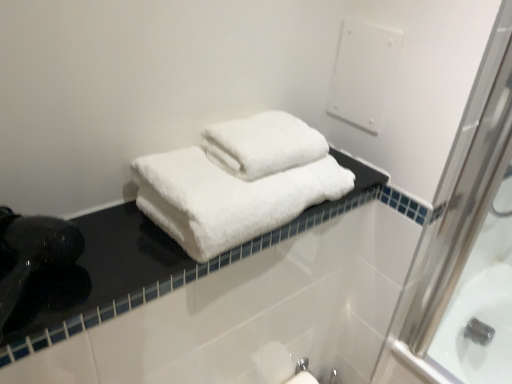
Locate an element on the screen. This screenshot has width=512, height=384. white fluffy towels at center is located at coordinates (227, 198).

The width and height of the screenshot is (512, 384). What do you see at coordinates (227, 198) in the screenshot?
I see `white fluffy towels at center` at bounding box center [227, 198].

This screenshot has height=384, width=512. Identify the location of black glossy counter top at center. (141, 267).

Describe the element at coordinates (141, 267) in the screenshot. I see `black glossy counter top at center` at that location.

Where is `white fluffy towels at center`? The image size is (512, 384). white fluffy towels at center is located at coordinates (227, 198).

Which is more to the left, black glossy counter top at center or white fluffy towels at center?

black glossy counter top at center is more to the left.

Is the position of black glossy counter top at center less distant than that of white fluffy towels at center?

Yes.

Which is behind, point (59, 305) or point (215, 203)?

The point (215, 203) is more distant.

From the image's perspective, which one is positioned higher, black glossy counter top at center or white fluffy towels at center?

white fluffy towels at center appears higher in the image.

From a real-world perspective, is black glossy counter top at center positioned above or below white fluffy towels at center?

black glossy counter top at center is below white fluffy towels at center.

Is black glossy counter top at center wider or thinner than white fluffy towels at center?

Clearly, black glossy counter top at center has less width compared to white fluffy towels at center.

Between black glossy counter top at center and white fluffy towels at center, which one has more height?

With more height is white fluffy towels at center.

Is black glossy counter top at center bigger than white fluffy towels at center?

Actually, black glossy counter top at center might be smaller than white fluffy towels at center.

Is white fluffy towels at center located within black glossy counter top at center?

No, white fluffy towels at center is located outside of black glossy counter top at center.

Based on the photo, are black glossy counter top at center and white fluffy towels at center located far from each other?

No.

Could you tell me if black glossy counter top at center is turned towards white fluffy towels at center?

No, black glossy counter top at center is not facing towards white fluffy towels at center.

How different are the orientations of black glossy counter top at center and white fluffy towels at center in degrees?

The angular difference between black glossy counter top at center and white fluffy towels at center is 0.693 degrees.

Measure the distance between black glossy counter top at center and white fluffy towels at center.

black glossy counter top at center is 4.04 inches from white fluffy towels at center.

Find the location of a particular element. The image size is (512, 384). towel positioned vertically above the black glossy counter top at center (from a real-world perspective) is located at coordinates (227, 198).

Does white fluffy towels at center appear on the right side of black glossy counter top at center?

Yes.

Based on the photo, is white fluffy towels at center in front of black glossy counter top at center?

No, white fluffy towels at center is behind black glossy counter top at center.

Which is nearer, (293, 199) or (104, 318)?

Point (293, 199).

From the image's perspective, which object appears higher, white fluffy towels at center or black glossy counter top at center?

white fluffy towels at center.

From a real-world perspective, who is located lower, white fluffy towels at center or black glossy counter top at center?

In real-world perspective, black glossy counter top at center is lower.

In the scene shown: Which object is thinner, white fluffy towels at center or black glossy counter top at center?

Thinner between the two is black glossy counter top at center.

Is white fluffy towels at center taller or shorter than black glossy counter top at center?

Considering their sizes, white fluffy towels at center has more height than black glossy counter top at center.

Which of these two, white fluffy towels at center or black glossy counter top at center, is smaller?

black glossy counter top at center is smaller.

In the scene shown: Can black glossy counter top at center be found inside white fluffy towels at center?

Definitely not — black glossy counter top at center is not inside white fluffy towels at center.

Is white fluffy towels at center not near black glossy counter top at center?

They are positioned close to each other.

Is white fluffy towels at center facing away from black glossy counter top at center?

white fluffy towels at center does not have its back to black glossy counter top at center.

Can you tell me how much white fluffy towels at center and black glossy counter top at center differ in facing direction?

0.693 degrees separate the facing orientations of white fluffy towels at center and black glossy counter top at center.

Where is `towel above the black glossy counter top at center (from the image's perspective)`? The image size is (512, 384). towel above the black glossy counter top at center (from the image's perspective) is located at coordinates (227, 198).

In order to click on counter top located below the white fluffy towels at center (from the image's perspective) in this screenshot , I will do `click(141, 267)`.

This screenshot has width=512, height=384. I want to click on towel above the black glossy counter top at center (from the image's perspective), so click(x=227, y=198).